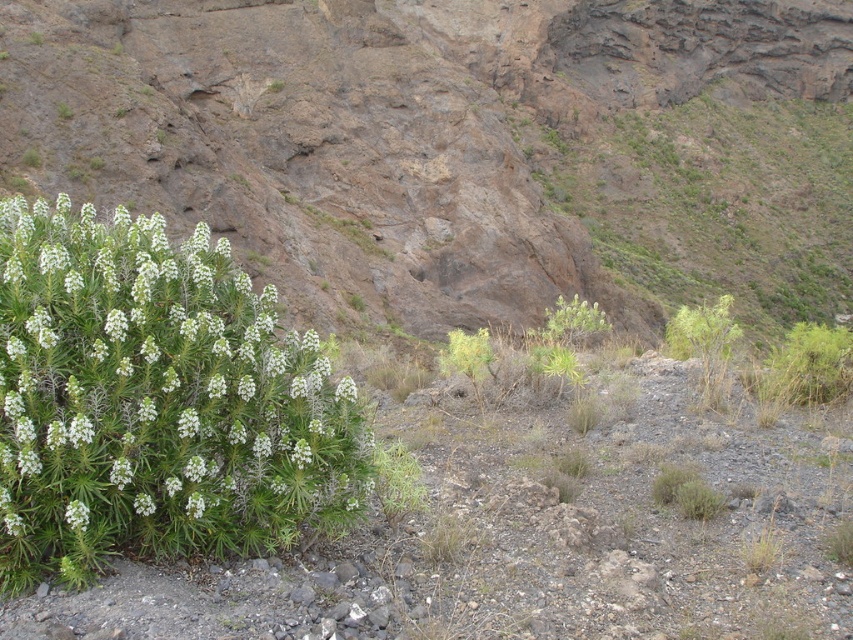
Is green grassy hillside at lower left wider than green leafy plant at lower left?

Yes.

Is green grassy hillside at lower left taller than green leafy plant at lower left?

Yes.

Is point (22, 147) positioned after point (74, 502)?

That is True.

Locate an element on the screen. The image size is (853, 640). green grassy hillside at lower left is located at coordinates (459, 148).

Is the position of green grassy hillside at lower left more distant than that of green leafy plant at left?

Yes, green grassy hillside at lower left is further from the viewer.

Can you confirm if green grassy hillside at lower left is bigger than green leafy plant at left?

Yes, green grassy hillside at lower left is bigger than green leafy plant at left.

Between point (79, 88) and point (360, 408), which one is positioned behind?

The point (79, 88) is behind.

This screenshot has width=853, height=640. Find the location of `green grassy hillside at lower left`. green grassy hillside at lower left is located at coordinates (459, 148).

Between green leafy plant at left and green leafy plant at lower left, which one is positioned higher?

green leafy plant at left is above.

Which is in front, point (334, 467) or point (80, 524)?

Point (80, 524) is in front.

Identify the location of green leafy plant at left. The image size is (853, 640). (155, 401).